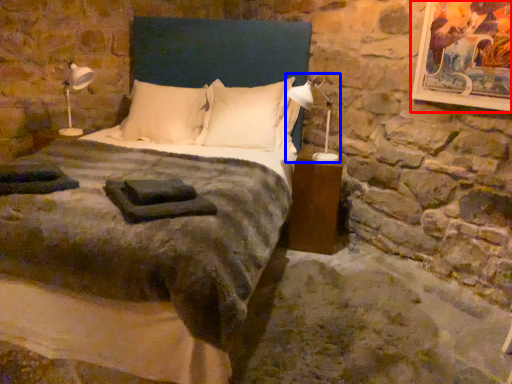
Question: Which object appears farthest to the camera in this image, picture frame (highlighted by a red box) or bedside lamp (highlighted by a blue box)?

Choices:
 (A) picture frame
 (B) bedside lamp

Answer: (B)